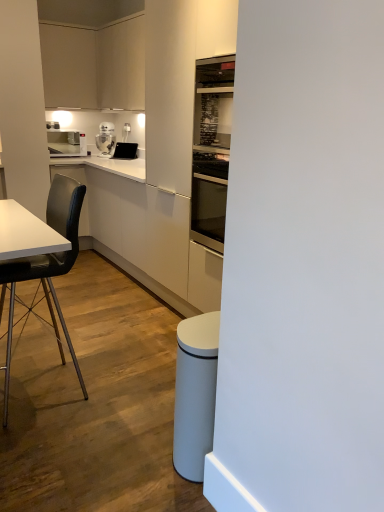
Question: Is black matte chair at left turned away from white glossy robot at upper center, acting as the first kitchen appliance starting from the right?

Choices:
 (A) no
 (B) yes

Answer: (A)

Question: Can you confirm if black matte chair at left is positioned to the right of white glossy robot at upper center, acting as the first kitchen appliance starting from the right?

Choices:
 (A) yes
 (B) no

Answer: (A)

Question: Is white glossy robot at upper center, arranged as the 2th kitchen appliance when viewed from the left, completely or partially inside black matte chair at left?

Choices:
 (A) no
 (B) yes

Answer: (A)

Question: Does black matte chair at left turn towards white glossy robot at upper center, acting as the first kitchen appliance starting from the right?

Choices:
 (A) no
 (B) yes

Answer: (A)

Question: Is black matte chair at left completely or partially outside of white glossy robot at upper center, arranged as the 2th kitchen appliance when viewed from the left?

Choices:
 (A) yes
 (B) no

Answer: (A)

Question: Is black matte chair at left smaller than white glossy robot at upper center, acting as the first kitchen appliance starting from the right?

Choices:
 (A) yes
 (B) no

Answer: (B)

Question: Is white glossy counter at center to the left of black matte chair at left from the viewer's perspective?

Choices:
 (A) yes
 (B) no

Answer: (A)

Question: From a real-world perspective, is white glossy counter at center physically below black matte chair at left?

Choices:
 (A) no
 (B) yes

Answer: (B)

Question: Does white glossy counter at center have a smaller size compared to black matte chair at left?

Choices:
 (A) no
 (B) yes

Answer: (A)

Question: Does white glossy counter at center come in front of black matte chair at left?

Choices:
 (A) no
 (B) yes

Answer: (A)

Question: Considering the relative sizes of white glossy counter at center and black matte chair at left in the image provided, is white glossy counter at center taller than black matte chair at left?

Choices:
 (A) no
 (B) yes

Answer: (A)

Question: Is black matte chair at left at the back of white glossy counter at center?

Choices:
 (A) yes
 (B) no

Answer: (B)

Question: Does black matte chair at left have a larger size compared to matte black tablet at upper center?

Choices:
 (A) yes
 (B) no

Answer: (A)